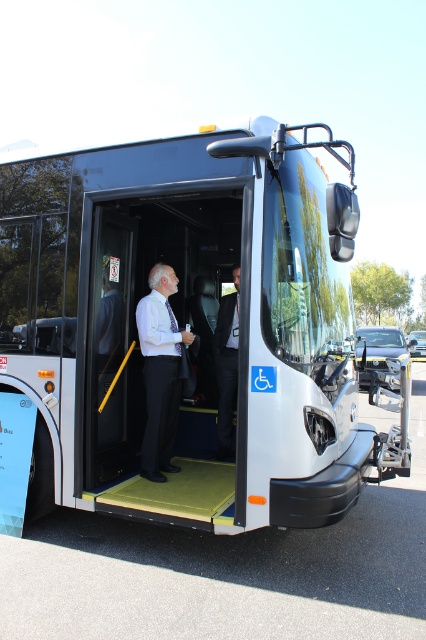
You are a passenger waiting at the bus stop. You see the white metallic bus at center and the dark gray suit at center. Which object is positioned higher from the ground?

The white metallic bus at center is located above the dark gray suit at center, so it is higher from the ground.

You are a passenger waiting to board the bus and see two people at the center of the image, a white glossy shirt at center and a dark gray suit at center. Which one is closer to the bus door?

The white glossy shirt at center is closer to the bus door because it is in front of the dark gray suit at center.

In the scene shown: You are a passenger standing at the bus entrance and want to reach the point marked as point (164,276). Is this point closer to you or further away compared to the point marked as point (150,445)?

The point (164,276) is further to the camera than point (150,445), so it is further away from you compared to the other point.